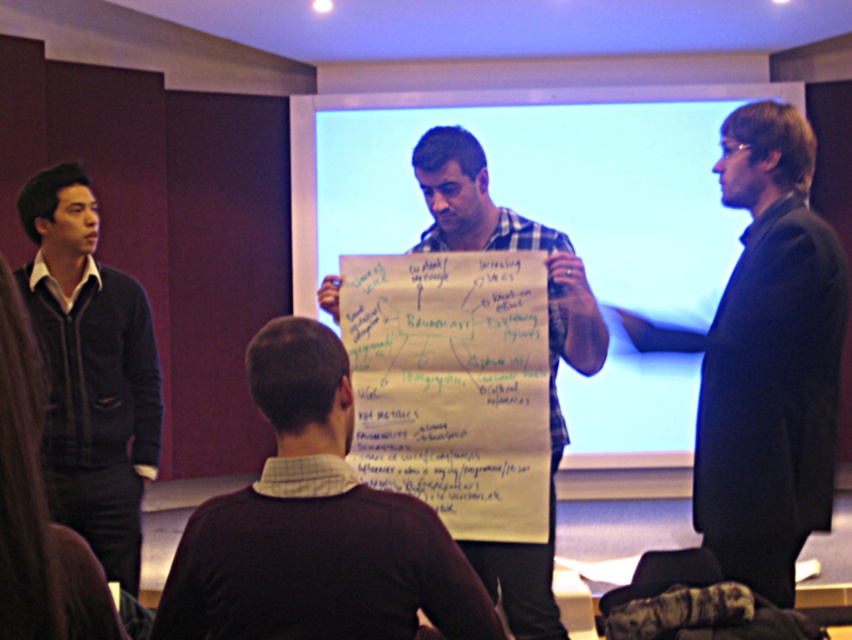
Question: Which object is closer to the camera taking this photo?

Choices:
 (A) whiteboard at center
 (B) black smooth suit at right
 (C) dark brown sweater at center

Answer: (C)

Question: Which of the following is the closest to the observer?

Choices:
 (A) (130, 340)
 (B) (803, 396)
 (C) (632, 168)

Answer: (B)

Question: Does whiteboard at center have a larger size compared to white paperboard at center?

Choices:
 (A) no
 (B) yes

Answer: (B)

Question: Does dark brown sweater at center have a smaller size compared to black smooth suit at right?

Choices:
 (A) yes
 (B) no

Answer: (A)

Question: Which point is closer to the camera taking this photo?

Choices:
 (A) (718, 420)
 (B) (142, 480)
 (C) (375, 502)

Answer: (C)

Question: Can you confirm if whiteboard at center is smaller than white paperboard at center?

Choices:
 (A) yes
 (B) no

Answer: (B)